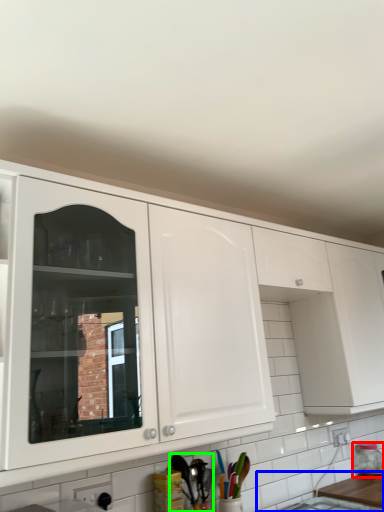
Question: Based on their relative distances, which object is nearer to bottle (highlighted by a red box)? Choose from counter top (highlighted by a blue box) and cutlery (highlighted by a green box).

Choices:
 (A) counter top
 (B) cutlery

Answer: (A)